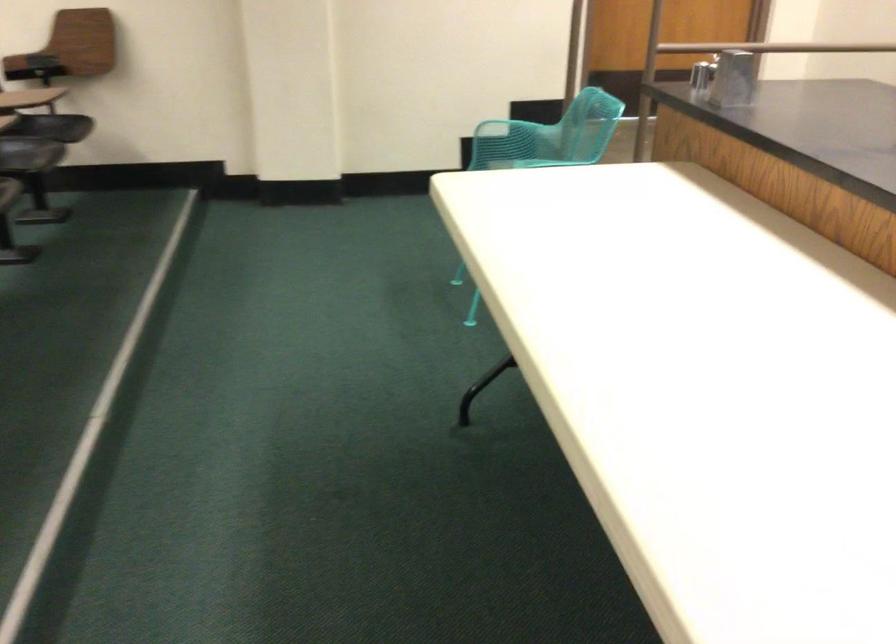
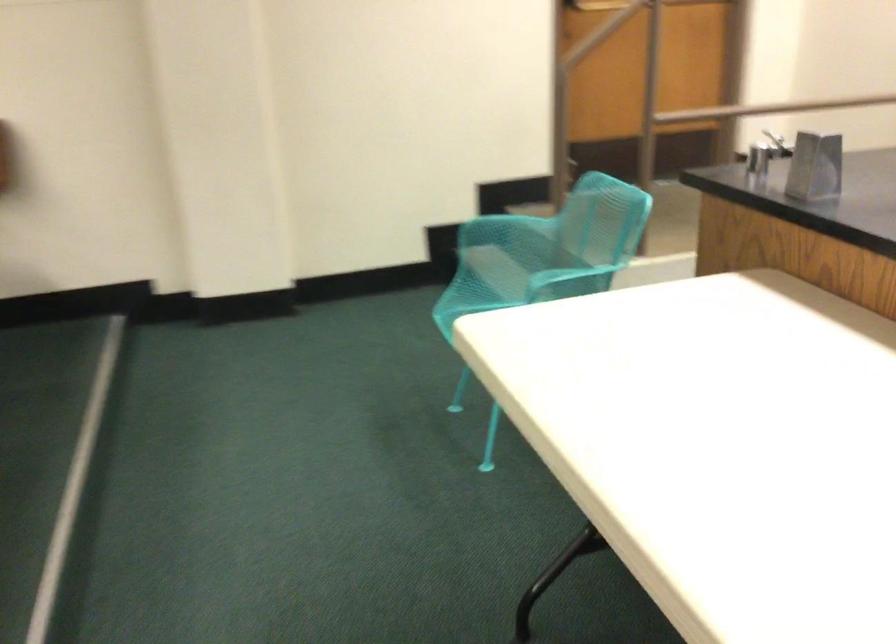
Where in the second image is the point corresponding to (x=506, y=126) from the first image?

(494, 218)